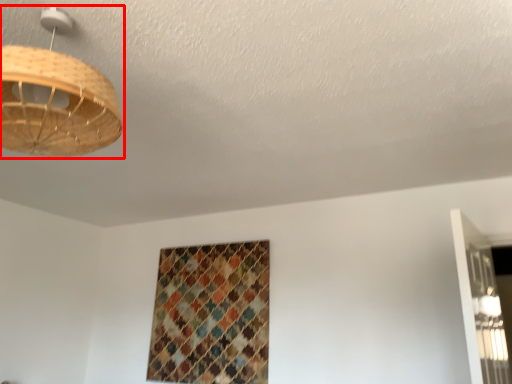
Question: From the image, what is the correct spatial relationship of lamp (annotated by the red box) in relation to pattern?

Choices:
 (A) left
 (B) right

Answer: (A)